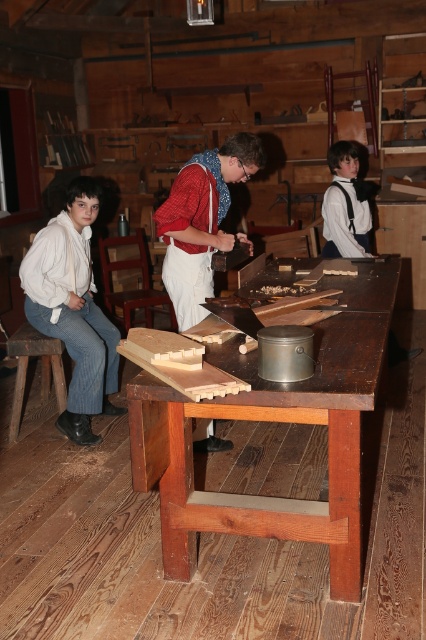
Is wooden table at center below matte red shirt at center?

Indeed, wooden table at center is positioned under matte red shirt at center.

Does wooden table at center have a smaller size compared to matte red shirt at center?

Actually, wooden table at center might be larger than matte red shirt at center.

Measure the distance between wooden table at center and camera.

wooden table at center and camera are 6.08 feet apart from each other.

At what (x,y) coordinates should I click in order to perform the action: click on wooden table at center. Please return your answer as a coordinate pair (x, y). Image resolution: width=426 pixels, height=640 pixels. Looking at the image, I should click on (273, 420).

Is point (342, 202) positioned after point (17, 332)?

Yes, point (342, 202) is behind point (17, 332).

Can you confirm if white cotton shirt at center is smaller than wooden at left?

Incorrect, white cotton shirt at center is not smaller in size than wooden at left.

At what (x,y) coordinates should I click in order to perform the action: click on white cotton shirt at center. Please return your answer as a coordinate pair (x, y). This screenshot has width=426, height=640. Looking at the image, I should click on (345, 204).

Who is more distant from viewer, [344,296] or [63,403]?

The point [63,403] is more distant.

Does wooden table at center lie behind wooden at left?

Answer: No, wooden table at center is in front of wooden at left.

Between point (270, 385) and point (51, 353), which one is positioned in front?

Positioned in front is point (270, 385).

Where is `wooden table at center`? The width and height of the screenshot is (426, 640). wooden table at center is located at coordinates (273, 420).